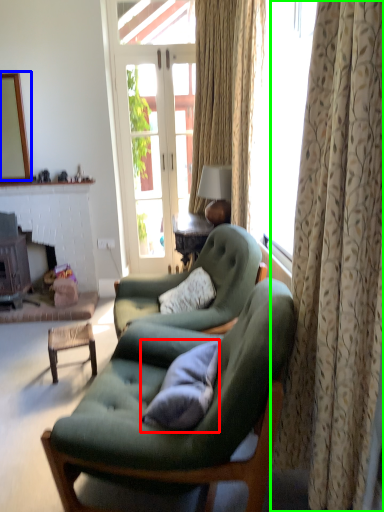
Question: Which is nearer to the pillow (highlighted by a red box)? mirror (highlighted by a blue box) or curtain (highlighted by a green box).

Choices:
 (A) mirror
 (B) curtain

Answer: (B)